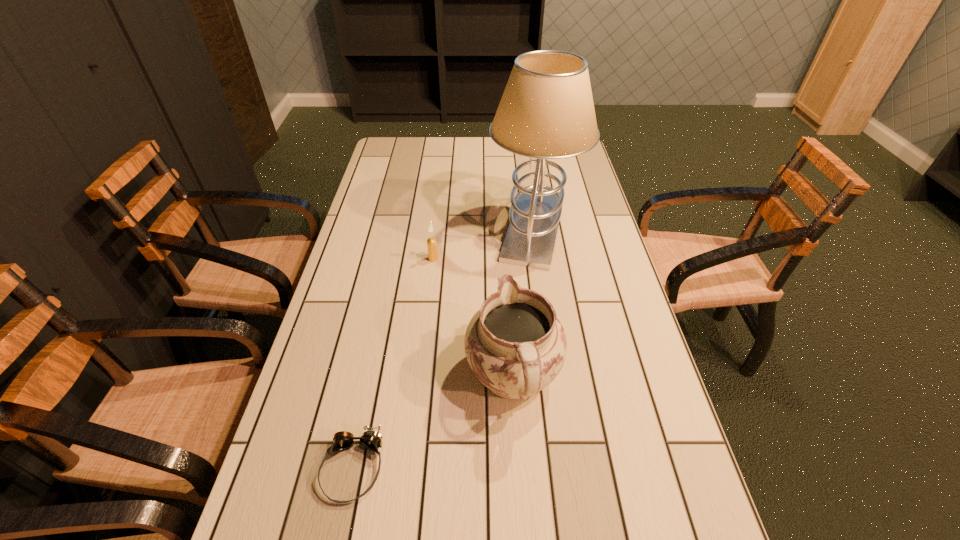
Identify the location of vacant point located between the tallest object and the goggles. This screenshot has width=960, height=540. (444, 348).

Identify the location of vacant space in between the leftmost object and the second shortest object. (393, 363).

I want to click on free space between the tallest object and the shortest object, so click(444, 348).

Locate which object is the third closest to the nearest object. Please provide its 2D coordinates. Your answer should be formatted as a tuple, i.e. [(x, y)], where the tuple contains the x and y coordinates of a point satisfying the conditions above.

[(546, 111)]

At what (x,y) coordinates should I click in order to perform the action: click on object identified as the closest to the pitcher. Please return your answer as a coordinate pair (x, y). Looking at the image, I should click on (370, 439).

Identify the location of free space that satisfies the following two spatial constraints: 1. on the back side of the candle; 2. on the left side of the table lamp. The image size is (960, 540). (437, 227).

Locate an element on the screen. vacant space that satisfies the following two spatial constraints: 1. on the spout of the third farthest object; 2. on the right side of the tallest object is located at coordinates (504, 227).